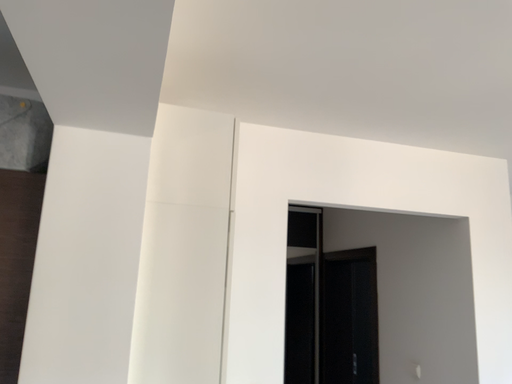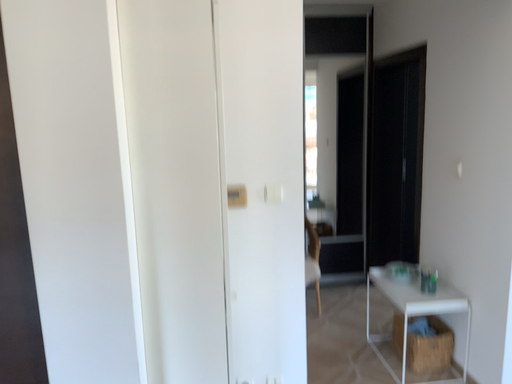
Question: How did the camera likely rotate when shooting the video?

Choices:
 (A) rotated upward
 (B) rotated downward

Answer: (B)